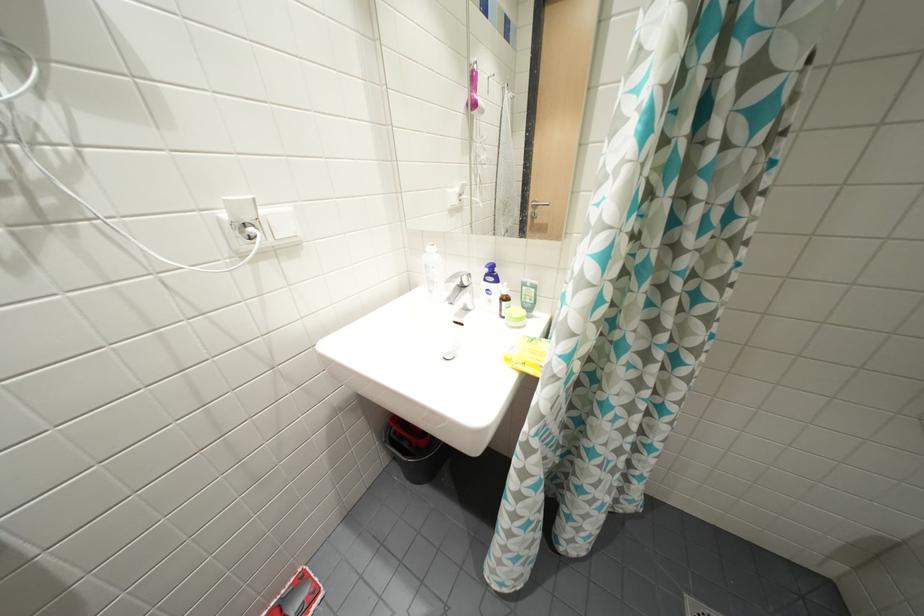
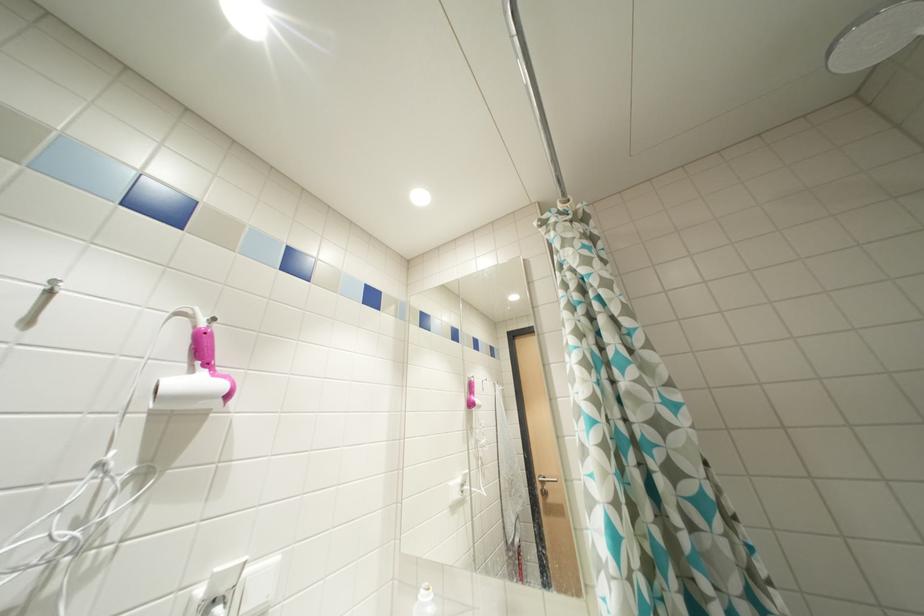
Question: How did the camera likely rotate?

Choices:
 (A) Left
 (B) Right
 (C) Up
 (D) Down

Answer: (C)